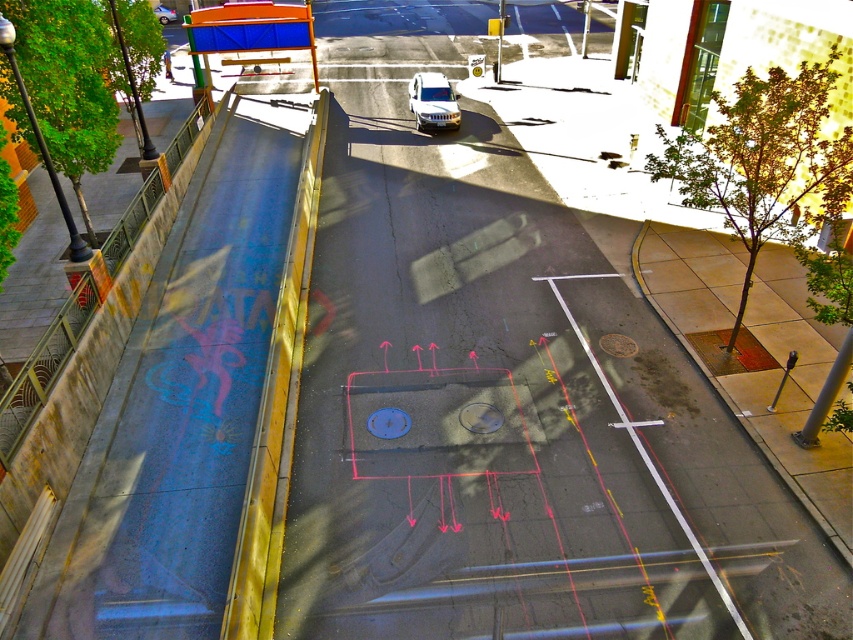
Question: Which of the following is the farthest from the observer?

Choices:
 (A) white matte van at center
 (B) metallic silver sedan at center

Answer: (B)

Question: Can you confirm if white matte van at center is wider than metallic silver sedan at center?

Choices:
 (A) no
 (B) yes

Answer: (A)

Question: Among these objects, which one is farthest from the camera?

Choices:
 (A) white matte van at center
 (B) metallic silver sedan at center

Answer: (B)

Question: Can you confirm if white matte van at center is bigger than metallic silver sedan at center?

Choices:
 (A) yes
 (B) no

Answer: (B)

Question: Which of the following is the closest to the observer?

Choices:
 (A) (436, 109)
 (B) (163, 12)

Answer: (A)

Question: Is the position of white matte van at center more distant than that of metallic silver sedan at center?

Choices:
 (A) no
 (B) yes

Answer: (A)